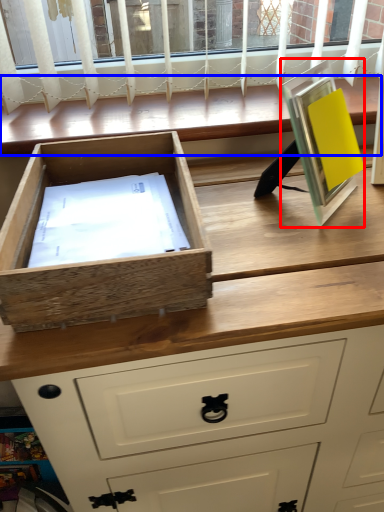
Question: Which of the following is the closest to the observer, picture frame (highlighted by a red box) or window (highlighted by a blue box)?

Choices:
 (A) picture frame
 (B) window

Answer: (A)